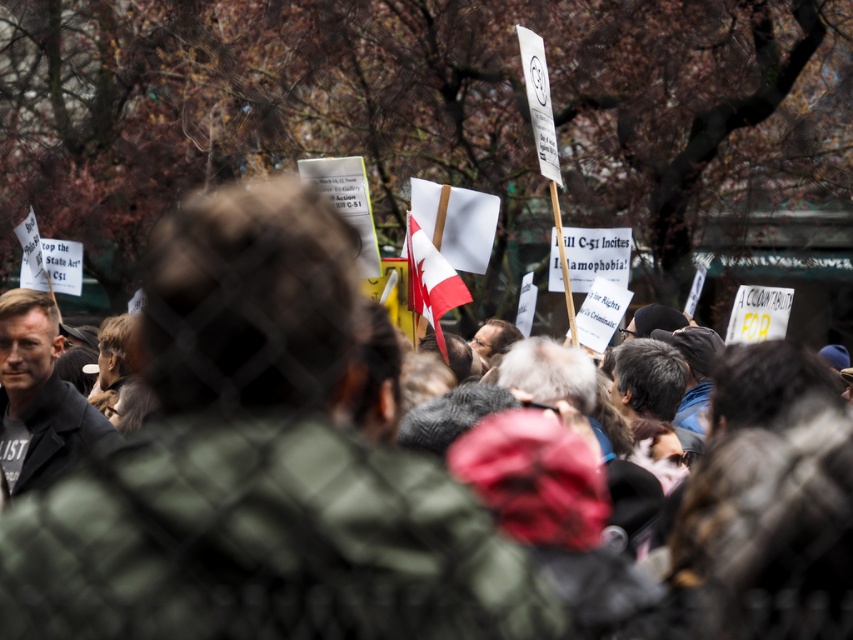
Question: Is red and white fabric flag at center positioned in front of white paper flag at upper left?

Choices:
 (A) no
 (B) yes

Answer: (B)

Question: Which point is farther to the camera?

Choices:
 (A) (28, 216)
 (B) (426, 244)

Answer: (A)

Question: Is red and white fabric flag at center to the left of white paper flag at upper left from the viewer's perspective?

Choices:
 (A) yes
 (B) no

Answer: (B)

Question: Which point appears farthest from the camera in this image?

Choices:
 (A) (422, 236)
 (B) (33, 269)

Answer: (B)

Question: Observing the image, what is the correct spatial positioning of red and white fabric flag at center in reference to white paper flag at upper left?

Choices:
 (A) above
 (B) below

Answer: (B)

Question: Which point is closer to the camera?

Choices:
 (A) (432, 317)
 (B) (35, 273)

Answer: (A)